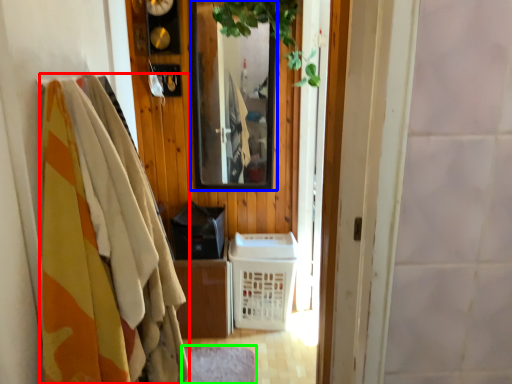
Question: Based on their relative distances, which object is nearer to clothing (highlighted by a red box)? Choose from mirror (highlighted by a blue box) and mat (highlighted by a green box).

Choices:
 (A) mirror
 (B) mat

Answer: (B)